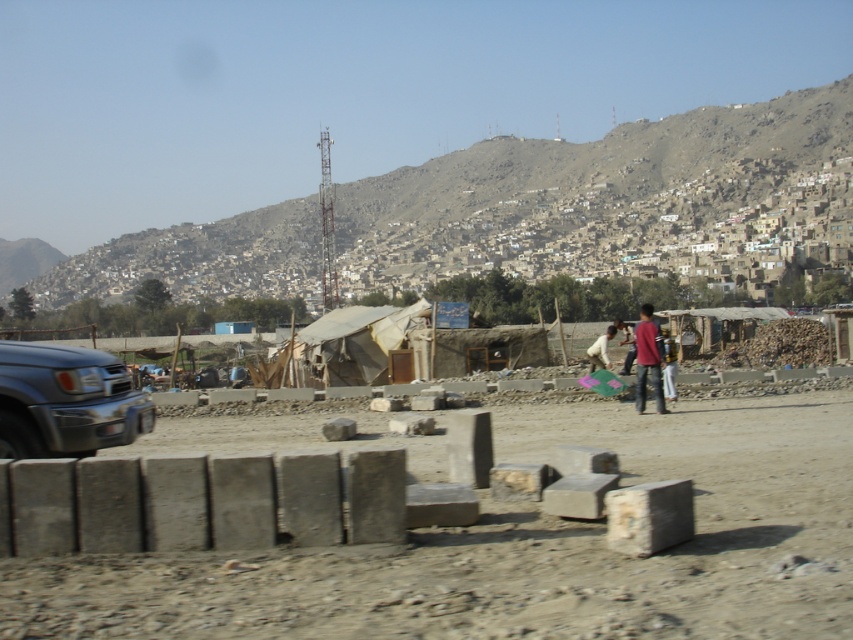
Is gray concrete blocks at center further to camera compared to brown textured hillside at upper center?

That is False.

Is point (85, 572) farther from camera compared to point (785, 209)?

No, it is in front of (785, 209).

Find the location of a particular element. gray concrete blocks at center is located at coordinates (526, 547).

Is metallic gray suv at left smaller than light brown fabric pants at center-right?

Yes.

Between point (4, 349) and point (665, 394), which one is positioned behind?

Positioned behind is point (665, 394).

This screenshot has height=640, width=853. What are the coordinates of `metallic gray suv at left` in the screenshot? It's located at (65, 401).

Does brown textured hillside at upper center have a lesser height compared to white cotton shirt at center?

Incorrect, brown textured hillside at upper center's height does not fall short of white cotton shirt at center's.

Does brown textured hillside at upper center come in front of white cotton shirt at center?

No, brown textured hillside at upper center is behind white cotton shirt at center.

The width and height of the screenshot is (853, 640). What do you see at coordinates (592, 195) in the screenshot? I see `brown textured hillside at upper center` at bounding box center [592, 195].

The image size is (853, 640). I want to click on brown textured hillside at upper center, so click(592, 195).